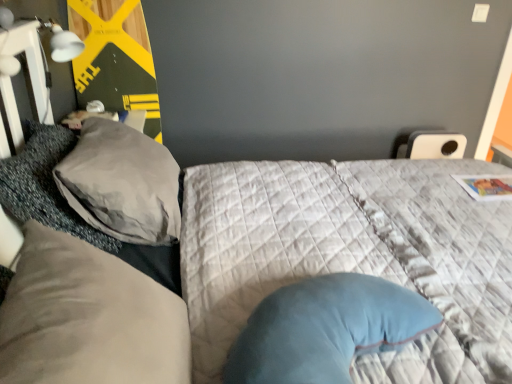
Question: From a real-world perspective, is suede-like beige pillow at left, the first pillow from the front, under gray textured pillow at left, the second pillow positioned from the back?

Choices:
 (A) yes
 (B) no

Answer: (B)

Question: Would you consider suede-like beige pillow at left, the first pillow from the front, to be distant from gray textured pillow at left, which is the second pillow in front-to-back order?

Choices:
 (A) no
 (B) yes

Answer: (A)

Question: Does suede-like beige pillow at left, which is the third pillow in back-to-front order, have a lesser width compared to gray textured pillow at left, which is the second pillow in front-to-back order?

Choices:
 (A) yes
 (B) no

Answer: (B)

Question: Is suede-like beige pillow at left, which is the third pillow in back-to-front order, positioned with its back to gray textured pillow at left, the second pillow positioned from the back?

Choices:
 (A) no
 (B) yes

Answer: (A)

Question: Is suede-like beige pillow at left, which is the third pillow in back-to-front order, aimed at gray textured pillow at left, which is the second pillow in front-to-back order?

Choices:
 (A) no
 (B) yes

Answer: (A)

Question: Is suede-like beige pillow at left, which is the third pillow in back-to-front order, with gray textured pillow at left, which is the second pillow in front-to-back order?

Choices:
 (A) no
 (B) yes

Answer: (A)

Question: Is suede-like beige pillow at left, the first pillow from the front, thinner than matte yellow wood board at upper left?

Choices:
 (A) no
 (B) yes

Answer: (A)

Question: From a real-world perspective, is suede-like beige pillow at left, which is the third pillow in back-to-front order, over matte yellow wood board at upper left?

Choices:
 (A) yes
 (B) no

Answer: (B)

Question: Does suede-like beige pillow at left, the first pillow from the front, have a greater width compared to matte yellow wood board at upper left?

Choices:
 (A) yes
 (B) no

Answer: (A)

Question: From the image's perspective, is suede-like beige pillow at left, the first pillow from the front, under matte yellow wood board at upper left?

Choices:
 (A) no
 (B) yes

Answer: (B)

Question: Is suede-like beige pillow at left, which is the third pillow in back-to-front order, at the right side of matte yellow wood board at upper left?

Choices:
 (A) no
 (B) yes

Answer: (B)

Question: Considering the relative sizes of suede-like beige pillow at left, the first pillow from the front, and matte yellow wood board at upper left in the image provided, is suede-like beige pillow at left, the first pillow from the front, bigger than matte yellow wood board at upper left?

Choices:
 (A) yes
 (B) no

Answer: (A)

Question: Considering the relative positions of gray textured pillow at left, the second pillow positioned from the back, and matte yellow wood board at upper left in the image provided, is gray textured pillow at left, the second pillow positioned from the back, to the right of matte yellow wood board at upper left from the viewer's perspective?

Choices:
 (A) no
 (B) yes

Answer: (B)